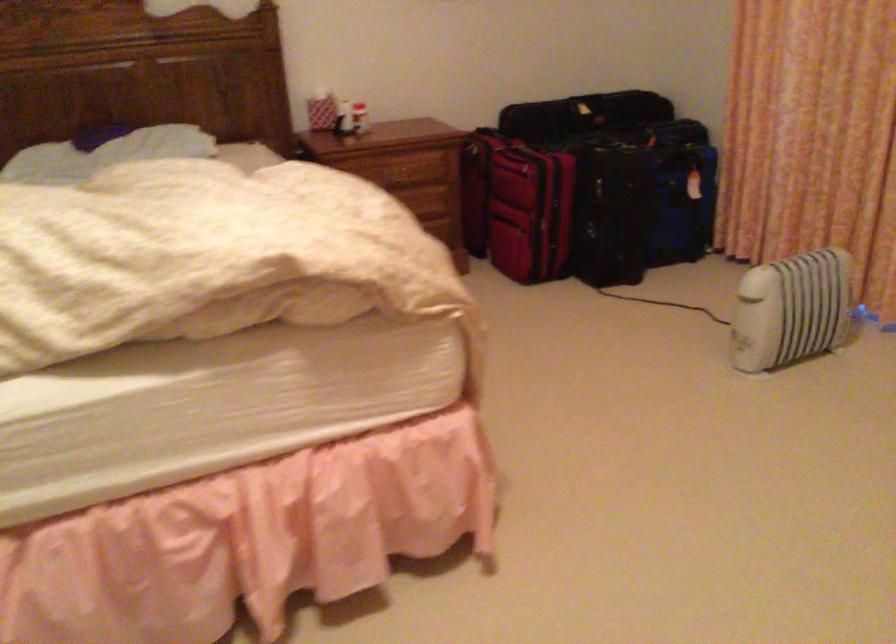
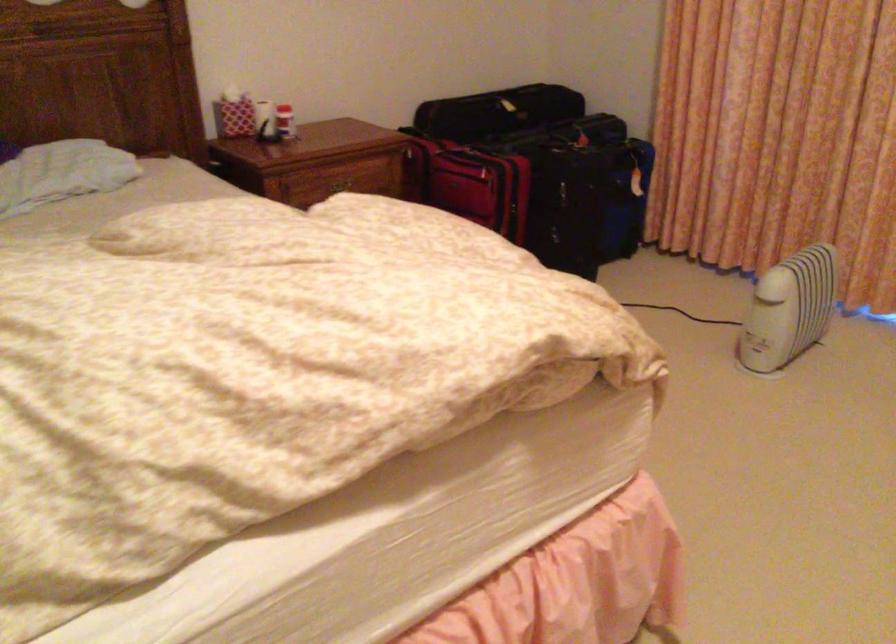
Where in the second image is the point corresponding to the point at 597,201 from the first image?

(566, 205)